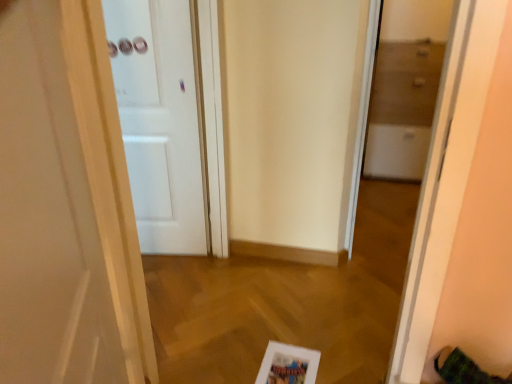
Question: Is white matte door at center, the second door in the front-to-back sequence, behind transparent glass cabinet at right?

Choices:
 (A) no
 (B) yes

Answer: (B)

Question: From the image's perspective, is white matte door at center, which appears as the 1th door when viewed from the back, above transparent glass cabinet at right?

Choices:
 (A) yes
 (B) no

Answer: (A)

Question: Is there a large distance between white matte door at center, which appears as the 1th door when viewed from the back, and transparent glass cabinet at right?

Choices:
 (A) yes
 (B) no

Answer: (B)

Question: Is white matte door at center, the second door in the front-to-back sequence, facing away from transparent glass cabinet at right?

Choices:
 (A) no
 (B) yes

Answer: (A)

Question: From the image's perspective, does white matte door at center, the second door in the front-to-back sequence, appear lower than transparent glass cabinet at right?

Choices:
 (A) no
 (B) yes

Answer: (A)

Question: Does white matte door at center, which appears as the 1th door when viewed from the back, turn towards transparent glass cabinet at right?

Choices:
 (A) no
 (B) yes

Answer: (A)

Question: Considering the relative sizes of white glossy door at left, acting as the first door starting from the front, and transparent glass cabinet at right in the image provided, is white glossy door at left, acting as the first door starting from the front, wider than transparent glass cabinet at right?

Choices:
 (A) no
 (B) yes

Answer: (A)

Question: Considering the relative sizes of white glossy door at left, the second door viewed from the back, and transparent glass cabinet at right in the image provided, is white glossy door at left, the second door viewed from the back, smaller than transparent glass cabinet at right?

Choices:
 (A) yes
 (B) no

Answer: (B)

Question: Is transparent glass cabinet at right inside white glossy door at left, the second door viewed from the back?

Choices:
 (A) no
 (B) yes

Answer: (A)

Question: Is white glossy door at left, the second door viewed from the back, far from transparent glass cabinet at right?

Choices:
 (A) no
 (B) yes

Answer: (B)

Question: Can you confirm if white glossy door at left, acting as the first door starting from the front, is positioned to the right of transparent glass cabinet at right?

Choices:
 (A) yes
 (B) no

Answer: (B)

Question: Is white glossy door at left, acting as the first door starting from the front, at the left side of transparent glass cabinet at right?

Choices:
 (A) no
 (B) yes

Answer: (B)

Question: Is the position of transparent glass cabinet at right less distant than that of white glossy door at left, the second door viewed from the back?

Choices:
 (A) yes
 (B) no

Answer: (B)